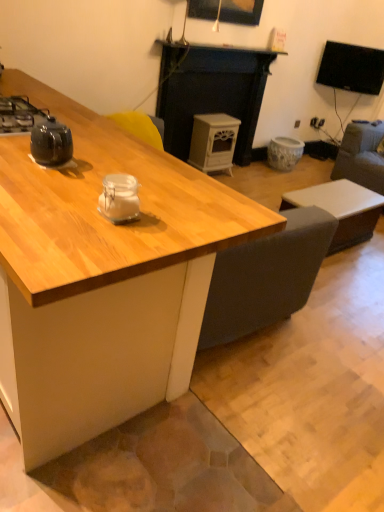
Question: From the image's perspective, relative to yellow fabric armchair at center, is black glossy tv at upper right above or below?

Choices:
 (A) below
 (B) above

Answer: (B)

Question: From a real-world perspective, is black glossy tv at upper right positioned above or below yellow fabric armchair at center?

Choices:
 (A) below
 (B) above

Answer: (B)

Question: Which object is the closest to the matte black teapot at left?

Choices:
 (A) black glossy kettle at left
 (B) dark gray fabric swivel chair at right
 (C) wooden desk at center
 (D) wooden picture frame at upper center
 (E) black glossy tv at upper right

Answer: (A)

Question: Which is nearer to the wooden desk at center?

Choices:
 (A) white matte wood stove at center
 (B) matte black teapot at left
 (C) black glossy tv at upper right
 (D) black glossy kettle at left
 (E) white wood stove at center

Answer: (B)